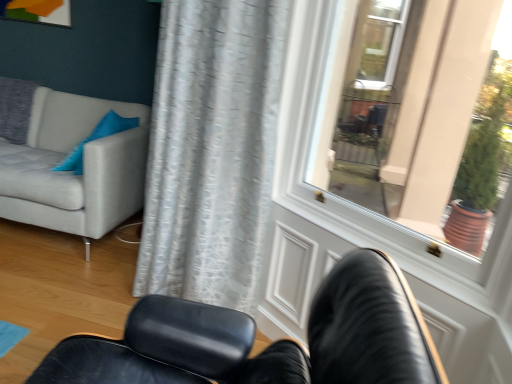
What is the approximate width of blue fabric pillow at upper left?

blue fabric pillow at upper left is 9.39 inches in width.

This screenshot has width=512, height=384. Describe the element at coordinates (96, 139) in the screenshot. I see `blue fabric pillow at upper left` at that location.

In order to face white glossy door at upper right, should I rotate leftwards or rightwards?

You should rotate right by 17.886 degrees.

Locate an element on the screen. white textured curtain at center is located at coordinates (212, 150).

Based on the photo, from a real-world perspective, is white glossy door at upper right under blue fabric pillow at upper left?

No.

Is white glossy door at upper right next to blue fabric pillow at upper left and touching it?

No.

Consider the image. Considering the relative sizes of white glossy door at upper right and blue fabric pillow at upper left in the image provided, is white glossy door at upper right wider than blue fabric pillow at upper left?

Yes.

Would you consider light gray fabric couch at left to be distant from blue fabric pillow at upper left?

They are positioned close to each other.

From a real-world perspective, who is located lower, light gray fabric couch at left or blue fabric pillow at upper left?

light gray fabric couch at left is physically lower.

Choose the correct answer: Is light gray fabric couch at left inside blue fabric pillow at upper left or outside it?

light gray fabric couch at left exists outside the volume of blue fabric pillow at upper left.

Can you tell me how much light gray fabric couch at left and blue fabric pillow at upper left differ in facing direction?

The facing directions of light gray fabric couch at left and blue fabric pillow at upper left are 84.2 degrees apart.

Between white textured curtain at center and blue fabric pillow at upper left, which one appears on the left side from the viewer's perspective?

Positioned to the left is blue fabric pillow at upper left.

From the image's perspective, is white textured curtain at center on blue fabric pillow at upper left?

No, from the image's perspective, white textured curtain at center is not above blue fabric pillow at upper left.

The image size is (512, 384). Identify the location of curtain that is above the blue fabric pillow at upper left (from a real-world perspective). (212, 150).

Could you tell me if white textured curtain at center is facing blue fabric pillow at upper left?

No, white textured curtain at center does not turn towards blue fabric pillow at upper left.

Which is more to the left, white textured curtain at center or black leather chair at lower center?

white textured curtain at center.

From the image's perspective, is white textured curtain at center below black leather chair at lower center?

No, from the image's perspective, white textured curtain at center is not beneath black leather chair at lower center.

Is white textured curtain at center positioned in front of black leather chair at lower center?

No, white textured curtain at center is behind black leather chair at lower center.

From the picture: Are blue fabric pillow at upper left and white glossy door at upper right far apart?

Yes, blue fabric pillow at upper left is far from white glossy door at upper right.

Is blue fabric pillow at upper left in front of or behind white glossy door at upper right in the image?

blue fabric pillow at upper left is positioned farther from the viewer than white glossy door at upper right.

Is blue fabric pillow at upper left wider or thinner than white glossy door at upper right?

blue fabric pillow at upper left is thinner than white glossy door at upper right.

Who is bigger, blue fabric pillow at upper left or white glossy door at upper right?

Bigger between the two is white glossy door at upper right.

Looking at their sizes, would you say black leather chair at lower center is wider or thinner than white textured curtain at center?

Considering their sizes, black leather chair at lower center looks broader than white textured curtain at center.

Which of these two, black leather chair at lower center or white textured curtain at center, stands shorter?

With less height is black leather chair at lower center.

Which of these two, black leather chair at lower center or white textured curtain at center, is smaller?

With smaller size is black leather chair at lower center.

From the image's perspective, which is below, light gray fabric couch at left or white textured curtain at center?

From the image's view, white textured curtain at center is below.

Between light gray fabric couch at left and white textured curtain at center, which one appears on the left side from the viewer's perspective?

Positioned to the left is light gray fabric couch at left.

Which point is more forward, (113, 134) or (231, 232)?

The point (231, 232) is closer to the camera.

In the image, there is a white glossy door at upper right. At what (x,y) coordinates should I click in order to perform the action: click on pillow below it (from a real-world perspective). Please return your answer as a coordinate pair (x, y). Looking at the image, I should click on (96, 139).

What are the coordinates of `pillow that is above the light gray fabric couch at left (from the image's perspective)` in the screenshot? It's located at (96, 139).

From the image, which object appears to be farther from white textured curtain at center, light gray fabric couch at left or blue fabric pillow at upper left?

light gray fabric couch at left is positioned further to the anchor white textured curtain at center.

Based on their spatial positions, is light gray fabric couch at left or blue fabric pillow at upper left closer to black leather chair at lower center?

blue fabric pillow at upper left is positioned closer to the anchor black leather chair at lower center.

Based on their spatial positions, is light gray fabric couch at left or blue fabric pillow at upper left closer to white glossy door at upper right?

light gray fabric couch at left is positioned closer to the anchor white glossy door at upper right.

Based on the photo, based on their spatial positions, is light gray fabric couch at left or white glossy door at upper right closer to blue fabric pillow at upper left?

light gray fabric couch at left lies closer to blue fabric pillow at upper left than the other object.

Based on their spatial positions, is blue fabric pillow at upper left or light gray fabric couch at left further from white glossy door at upper right?

Based on the image, blue fabric pillow at upper left appears to be further to white glossy door at upper right.

When comparing their distances from white glossy door at upper right, does white textured curtain at center or blue fabric pillow at upper left seem closer?

Among the two, white textured curtain at center is located nearer to white glossy door at upper right.

Based on their spatial positions, is white glossy door at upper right or white textured curtain at center further from blue fabric pillow at upper left?

white glossy door at upper right lies further to blue fabric pillow at upper left than the other object.

From the image, which object appears to be nearer to white glossy door at upper right, black leather chair at lower center or white textured curtain at center?

Based on the image, white textured curtain at center appears to be nearer to white glossy door at upper right.

Locate an element on the screen. The height and width of the screenshot is (384, 512). curtain positioned between black leather chair at lower center and blue fabric pillow at upper left from near to far is located at coordinates (212, 150).

Identify the location of chair between white textured curtain at center and white glossy door at upper right from left to right. (269, 345).

Locate an element on the screen. This screenshot has width=512, height=384. studio couch positioned between black leather chair at lower center and blue fabric pillow at upper left from near to far is located at coordinates (64, 158).

Locate an element on the screen. curtain between white glossy door at upper right and blue fabric pillow at upper left from front to back is located at coordinates (212, 150).